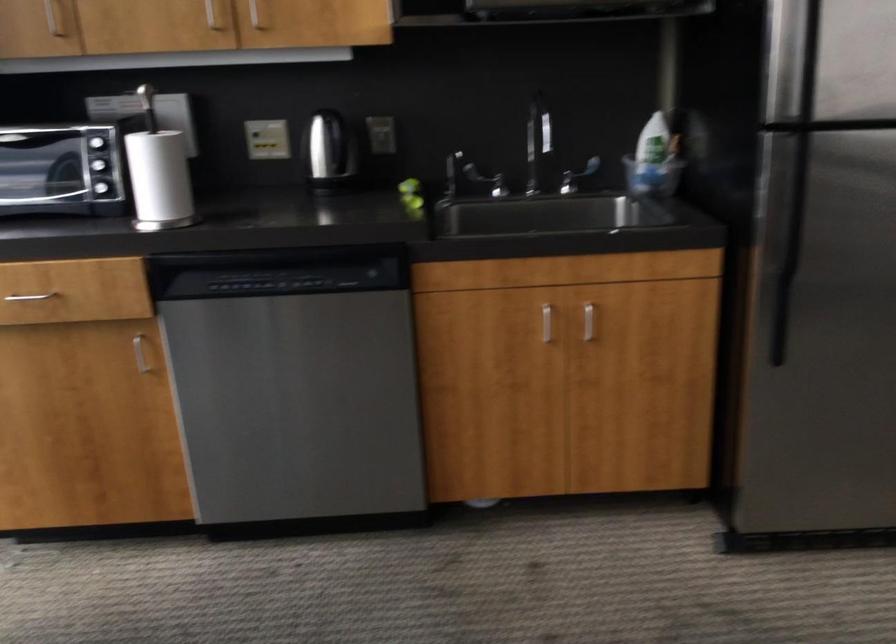
What are the coordinates of `refrigerator door handle` in the screenshot? It's located at (797, 181).